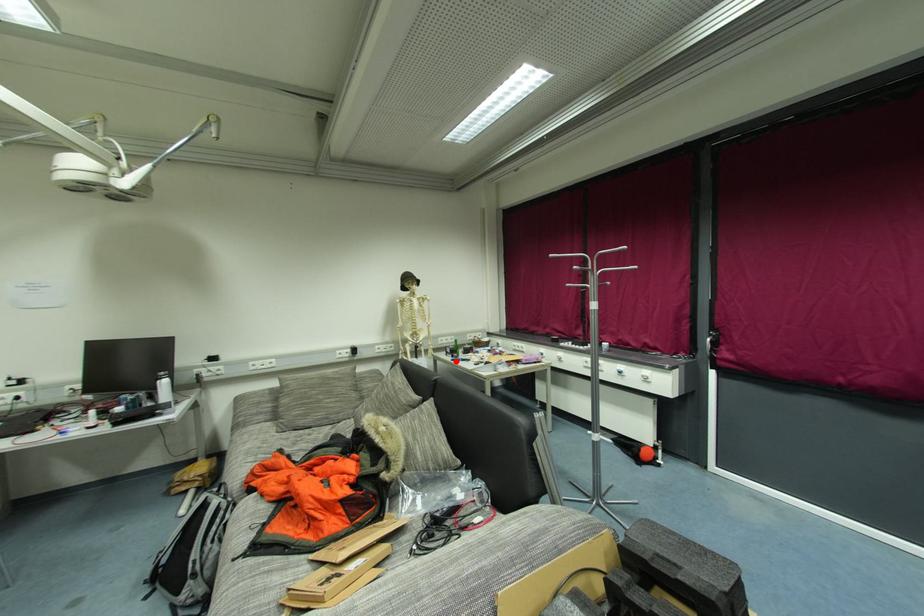
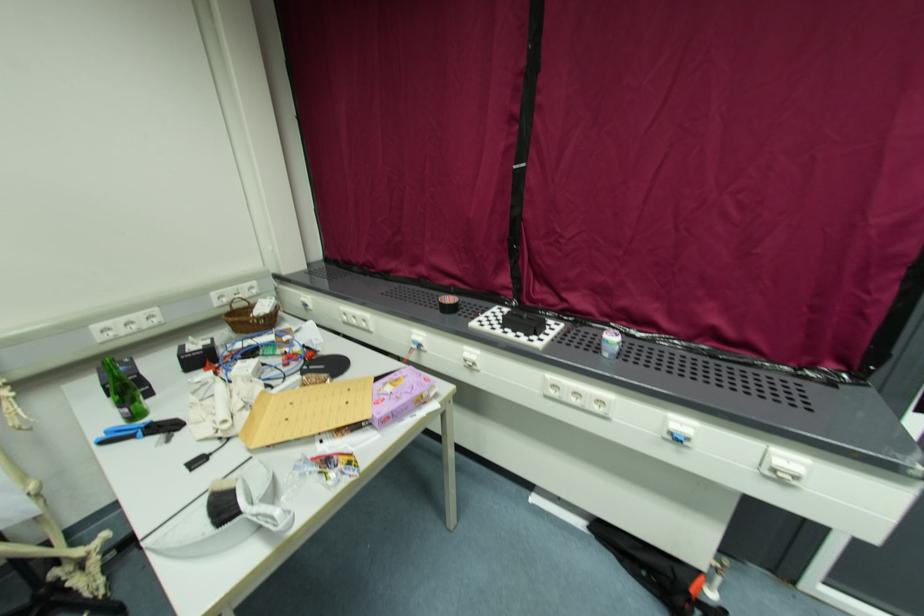
In the second image, find the point that corresponds to the highlighted location in the first image.

(107, 443)